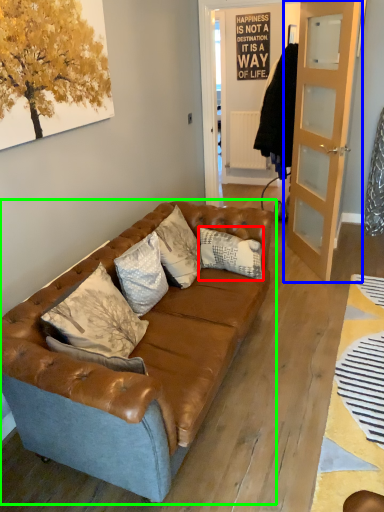
Question: Considering the real-world distances, which object is farthest from pillow (highlighted by a red box)? door (highlighted by a blue box) or studio couch (highlighted by a green box)?

Choices:
 (A) door
 (B) studio couch

Answer: (A)